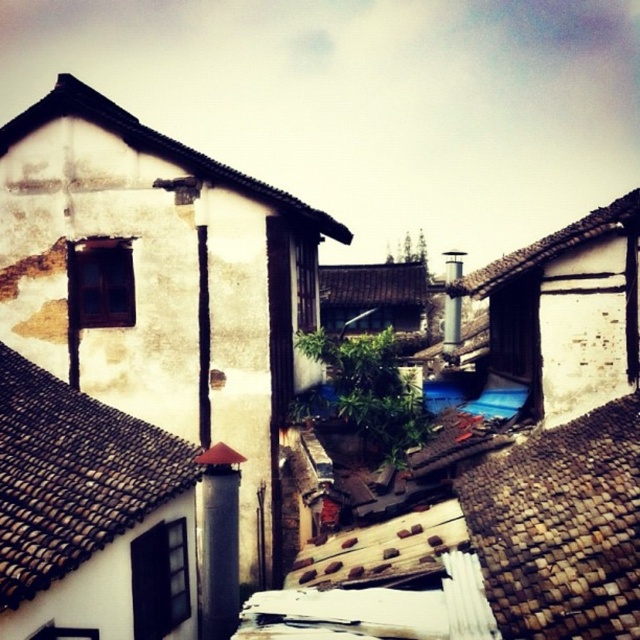
Who is positioned more to the left, brown shingles at lower right or brown tile roof at upper right?

Positioned to the left is brown shingles at lower right.

Between brown shingles at lower right and brown tile roof at upper right, which one has less height?

With less height is brown shingles at lower right.

This screenshot has width=640, height=640. In order to click on brown shingles at lower right in this screenshot , I will do `click(561, 528)`.

Between brown shingles at lower right and white textured roof at upper left, which one appears on the right side from the viewer's perspective?

brown shingles at lower right

The width and height of the screenshot is (640, 640). Describe the element at coordinates (561, 528) in the screenshot. I see `brown shingles at lower right` at that location.

Find the location of `brown shingles at lower right`. brown shingles at lower right is located at coordinates (561, 528).

Is brown tile roof at upper left bigger than white textured roof at upper left?

Incorrect, brown tile roof at upper left is not larger than white textured roof at upper left.

Is brown tile roof at upper left taller than white textured roof at upper left?

No, brown tile roof at upper left is not taller than white textured roof at upper left.

Locate an element on the screen. brown tile roof at upper left is located at coordinates (72, 476).